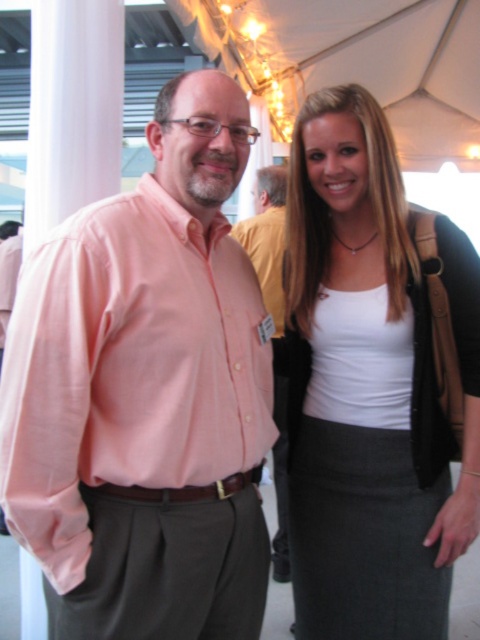
Is point (56, 412) farther from viewer compared to point (279, 285)?

No.

This screenshot has height=640, width=480. Describe the element at coordinates (145, 394) in the screenshot. I see `pink cotton shirt at center` at that location.

Is point (255, 632) positioned before point (273, 189)?

Yes, point (255, 632) is closer to viewer.

This screenshot has width=480, height=640. I want to click on pink cotton shirt at center, so click(x=145, y=394).

Can you confirm if pink cotton shirt at center is positioned to the right of white matte tank top at center?

No, pink cotton shirt at center is not to the right of white matte tank top at center.

Identify the location of pink cotton shirt at center. The width and height of the screenshot is (480, 640). (145, 394).

Does white matte tank top at center have a greater width compared to pink linen shirt at center?

Indeed, white matte tank top at center has a greater width compared to pink linen shirt at center.

Which is more to the right, white matte tank top at center or pink linen shirt at center?

white matte tank top at center

I want to click on white matte tank top at center, so click(373, 381).

Find the location of `white matte tank top at center`. white matte tank top at center is located at coordinates 373,381.